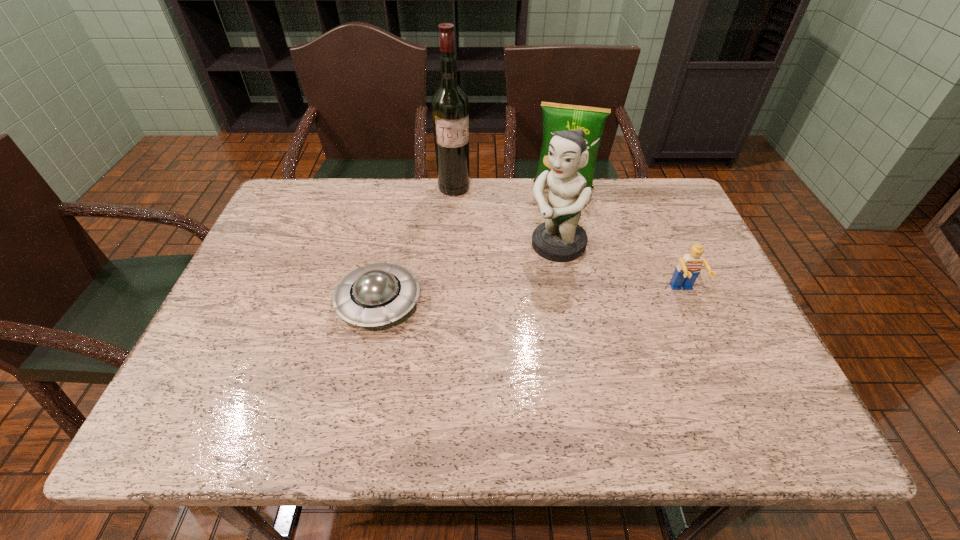
Where is `figurine positioned at the far edge`? This screenshot has height=540, width=960. figurine positioned at the far edge is located at coordinates [560, 238].

This screenshot has width=960, height=540. What are the coordinates of `crisp (potato chip) that is at the far edge` in the screenshot? It's located at (556, 117).

What are the coordinates of `wine bottle present at the far edge` in the screenshot? It's located at (450, 108).

I want to click on object located in the right edge section of the desktop, so click(x=688, y=269).

This screenshot has width=960, height=540. I want to click on vacant space at the far edge, so click(x=592, y=225).

Locate an element on the screen. Image resolution: width=960 pixels, height=540 pixels. vacant space at the near edge of the desktop is located at coordinates (275, 373).

In order to click on vacant space at the left edge in this screenshot , I will do `click(234, 305)`.

At what (x,y) coordinates should I click in order to perform the action: click on vacant area at the right edge. Please return your answer as a coordinate pair (x, y). This screenshot has height=540, width=960. Looking at the image, I should click on (683, 235).

Image resolution: width=960 pixels, height=540 pixels. In order to click on free space at the far left corner of the desktop in this screenshot , I will do `click(321, 198)`.

I want to click on vacant area at the far right corner, so click(676, 194).